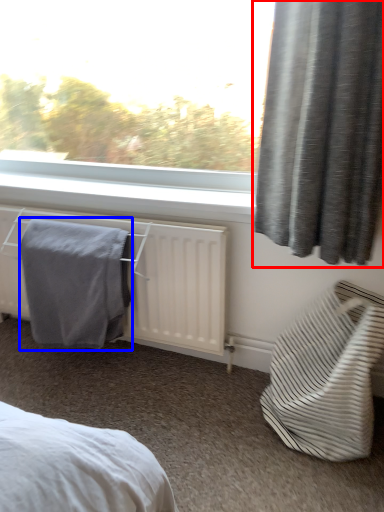
Question: Which object is closer to the camera taking this photo, curtain (highlighted by a red box) or bath towel (highlighted by a blue box)?

Choices:
 (A) curtain
 (B) bath towel

Answer: (A)